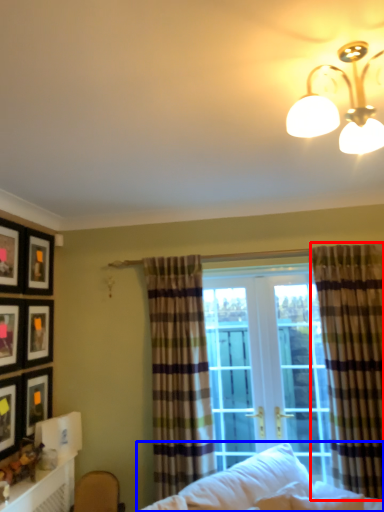
Question: Among these objects, which one is nearest to the camera, curtain (highlighted by a red box) or studio couch (highlighted by a blue box)?

Choices:
 (A) curtain
 (B) studio couch

Answer: (B)